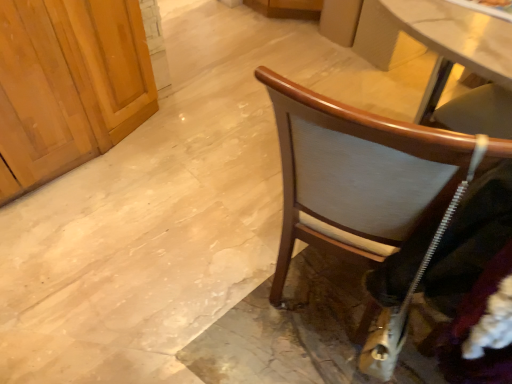
In the scene shown: Measure the distance between wooden chair at right and camera.

wooden chair at right and camera are 26.15 inches apart.

You are a GUI agent. You are given a task and a screenshot of the screen. Output one action in this format:
    pyautogui.click(x=<x>, y=<y>)
    Task: Click on the wooden chair at right
    The image size is (512, 384).
    Given the screenshot: What is the action you would take?
    pyautogui.click(x=356, y=174)

Describe the element at coordinates (356, 174) in the screenshot. The image size is (512, 384). I see `wooden chair at right` at that location.

Describe the element at coordinates (470, 239) in the screenshot. I see `velvet black jacket at right` at that location.

Where is `velvet black jacket at right`? This screenshot has height=384, width=512. velvet black jacket at right is located at coordinates (470, 239).

Measure the distance between velvet black jacket at right and camera.

They are 27.65 inches apart.

Locate an element on the screen. This screenshot has width=512, height=384. wooden chair at right is located at coordinates (356, 174).

Which is more to the right, wooden chair at right or velvet black jacket at right?

velvet black jacket at right.

Between wooden chair at right and velvet black jacket at right, which one is positioned in front?

velvet black jacket at right is closer to the camera.

Does point (419, 181) appear closer or farther from the camera than point (474, 212)?

Clearly, point (419, 181) is more distant from the camera than point (474, 212).

From the image's perspective, is wooden chair at right below velvet black jacket at right?

No, from the image's perspective, wooden chair at right is not below velvet black jacket at right.

From a real-world perspective, which object rests below the other?

In real-world perspective, wooden chair at right is lower.

Which object is wider, wooden chair at right or velvet black jacket at right?

Wider between the two is velvet black jacket at right.

Is wooden chair at right taller or shorter than velvet black jacket at right?

wooden chair at right is shorter than velvet black jacket at right.

Can you confirm if wooden chair at right is smaller than velvet black jacket at right?

No, wooden chair at right is not smaller than velvet black jacket at right.

Would you say wooden chair at right is outside velvet black jacket at right?

Yes, wooden chair at right is located beyond the bounds of velvet black jacket at right.

Is there a large distance between wooden chair at right and velvet black jacket at right?

That's not correct — wooden chair at right is a little close to velvet black jacket at right.

Does wooden chair at right turn towards velvet black jacket at right?

No, wooden chair at right is not aimed at velvet black jacket at right.

How different are the orientations of wooden chair at right and velvet black jacket at right in degrees?

There is a 23.7-degree angle between the facing directions of wooden chair at right and velvet black jacket at right.

You are a GUI agent. You are given a task and a screenshot of the screen. Output one action in this format:
    pyautogui.click(x=<x>, y=<y>)
    Task: Click on the chair on the left of velvet black jacket at right
    The height and width of the screenshot is (384, 512).
    Given the screenshot: What is the action you would take?
    tap(356, 174)

Which object is positioned more to the left, velvet black jacket at right or wooden chair at right?

Positioned to the left is wooden chair at right.

Which object is closer to the camera taking this photo, velvet black jacket at right or wooden chair at right?

velvet black jacket at right is more forward.

Does point (488, 206) lie in front of point (463, 168)?

No, (488, 206) is further to viewer.

From the image's perspective, relative to wooden chair at right, is velvet black jacket at right above or below?

velvet black jacket at right is below wooden chair at right.

From a real-world perspective, relative to wooden chair at right, is velvet black jacket at right vertically above or below?

In terms of real-world spatial position, velvet black jacket at right is above wooden chair at right.

Is velvet black jacket at right wider than wooden chair at right?

Yes.

Is velvet black jacket at right taller than wooden chair at right?

Correct, velvet black jacket at right is much taller as wooden chair at right.

Looking at this image, considering the relative sizes of velvet black jacket at right and wooden chair at right in the image provided, is velvet black jacket at right smaller than wooden chair at right?

Correct, velvet black jacket at right occupies less space than wooden chair at right.

Based on the photo, which is correct: velvet black jacket at right is inside wooden chair at right, or outside of it?

velvet black jacket at right cannot be found inside wooden chair at right.

Is velvet black jacket at right far away from wooden chair at right?

velvet black jacket at right is near wooden chair at right, not far away.

Is velvet black jacket at right aimed at wooden chair at right?

No, velvet black jacket at right does not turn towards wooden chair at right.

How many degrees apart are the facing directions of velvet black jacket at right and wooden chair at right?

The angular difference between velvet black jacket at right and wooden chair at right is 23.7 degrees.

You are a GUI agent. You are given a task and a screenshot of the screen. Output one action in this format:
    pyautogui.click(x=<x>, y=<y>)
    Task: Click on the chair behind the velvet black jacket at right
    The image size is (512, 384).
    Given the screenshot: What is the action you would take?
    pyautogui.click(x=356, y=174)

This screenshot has height=384, width=512. In order to click on chair below the velvet black jacket at right (from a real-world perspective) in this screenshot , I will do `click(356, 174)`.

The width and height of the screenshot is (512, 384). I want to click on clothing below the wooden chair at right (from the image's perspective), so click(x=470, y=239).